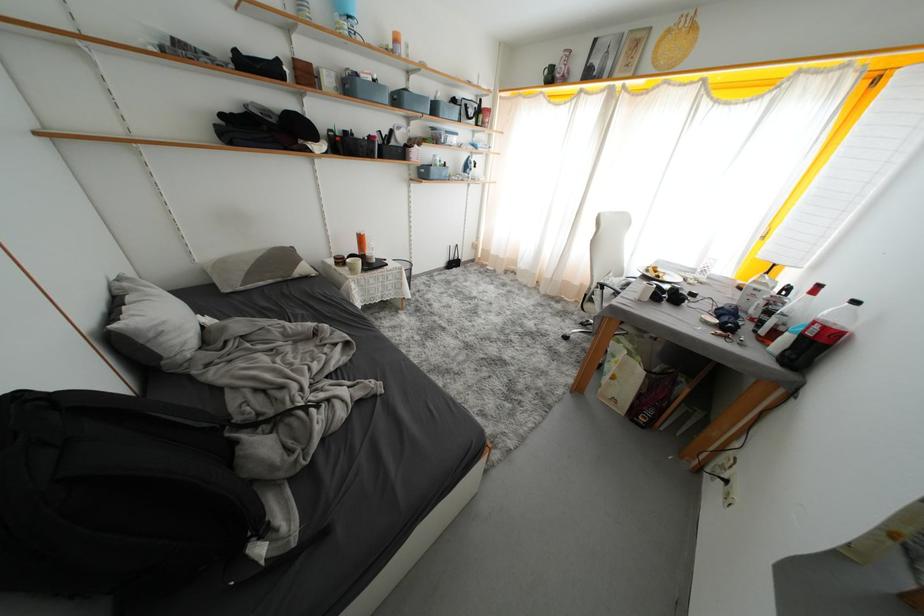
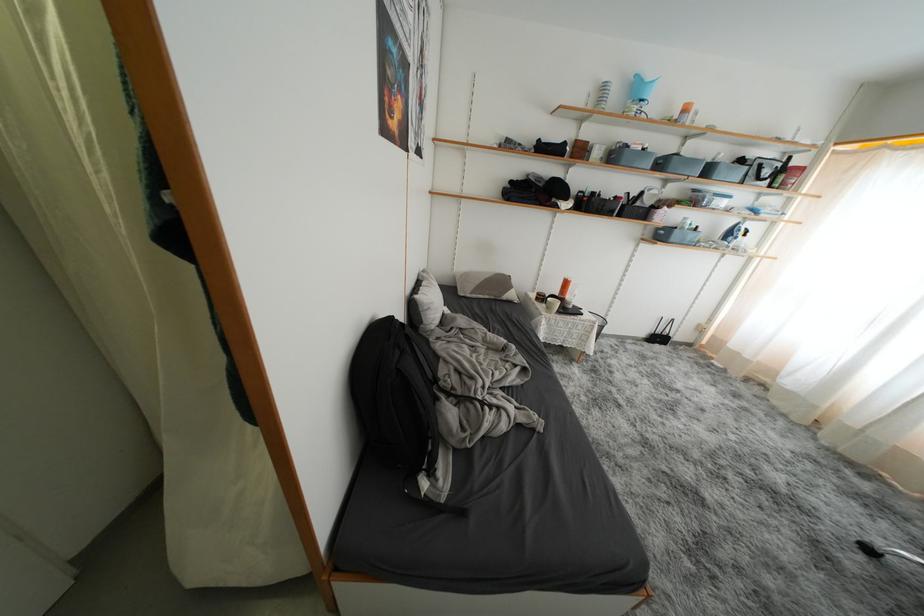
The point at (404, 103) is marked in the first image. Where is the corresponding point in the second image?

(667, 168)